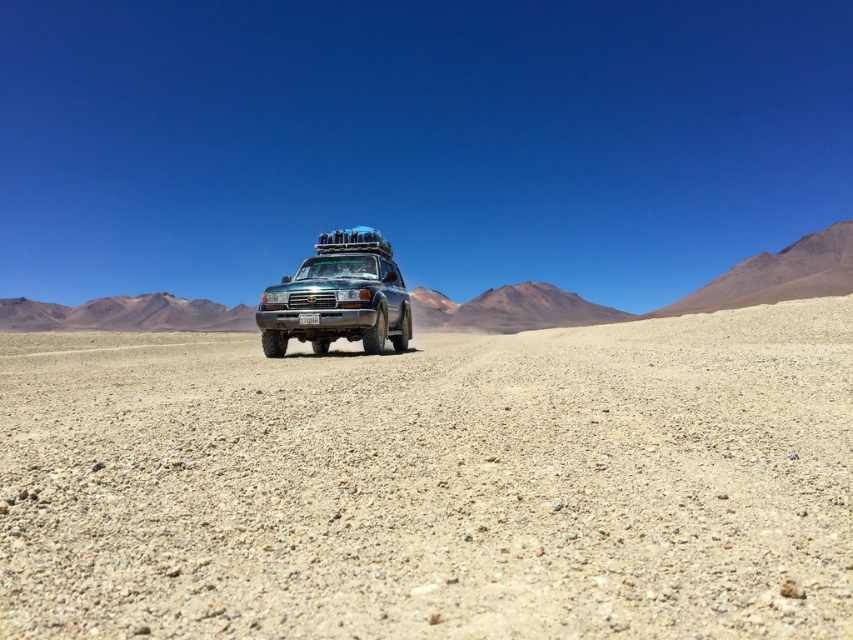
Question: Which point is closer to the camera?

Choices:
 (A) (306, 316)
 (B) (579, 561)

Answer: (B)

Question: Can you confirm if light brown gravel at center is smaller than green matte jeep at center?

Choices:
 (A) no
 (B) yes

Answer: (A)

Question: Does light brown gravel at center have a smaller size compared to green matte jeep at center?

Choices:
 (A) no
 (B) yes

Answer: (A)

Question: Which object is closer to the camera taking this photo?

Choices:
 (A) light brown gravel at center
 (B) green matte jeep at center

Answer: (A)

Question: Which of the following is the closest to the observer?

Choices:
 (A) light brown gravel at center
 (B) green matte jeep at center

Answer: (A)

Question: Can you confirm if light brown gravel at center is positioned above green matte jeep at center?

Choices:
 (A) yes
 (B) no

Answer: (B)